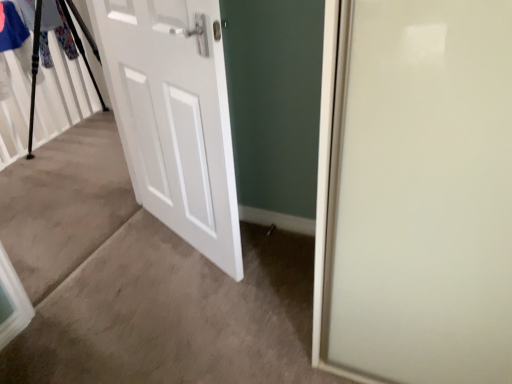
I want to click on white matte door at center, so click(x=174, y=117).

What do you see at coordinates (174, 117) in the screenshot? I see `white matte door at center` at bounding box center [174, 117].

This screenshot has height=384, width=512. In order to click on white matte door at center in this screenshot , I will do `click(174, 117)`.